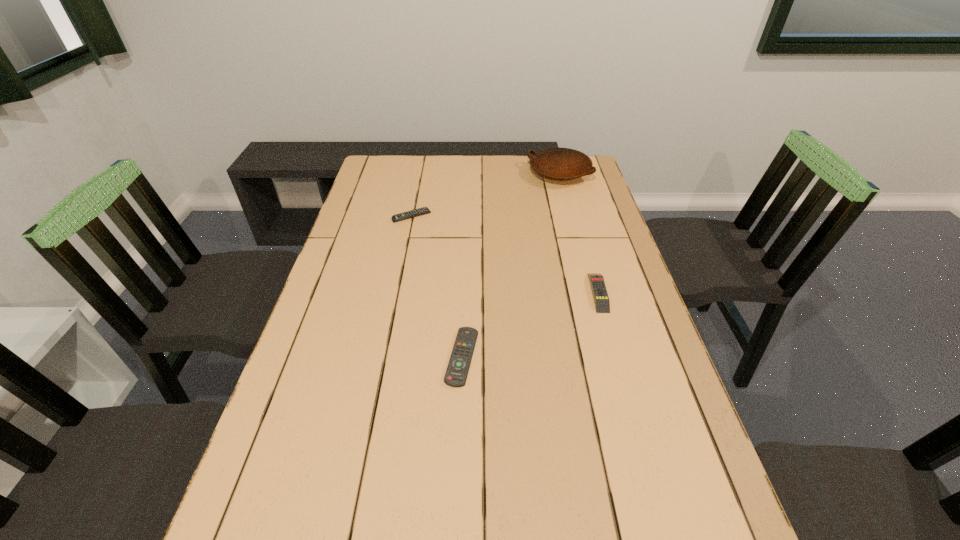
Where is `vacant space situated on the front of the leftmost remote control`? The image size is (960, 540). vacant space situated on the front of the leftmost remote control is located at coordinates (397, 286).

Identify the location of vacant space situated on the left of the second object from left to right. coord(361,357).

This screenshot has width=960, height=540. Identify the location of object positioned at the far edge. (556, 163).

What are the coordinates of `object at the left edge` in the screenshot? It's located at (424, 210).

This screenshot has width=960, height=540. Find the location of `plate located in the right edge section of the desktop`. plate located in the right edge section of the desktop is located at coordinates (556, 163).

Where is `remote control situated at the right edge`? The width and height of the screenshot is (960, 540). remote control situated at the right edge is located at coordinates (602, 304).

Locate an element on the screen. This screenshot has width=960, height=540. object situated at the far right corner is located at coordinates (556, 163).

The image size is (960, 540). Find the location of `vacant space at the far edge`. vacant space at the far edge is located at coordinates (437, 171).

Where is `blank area at the left edge`? This screenshot has width=960, height=540. blank area at the left edge is located at coordinates (276, 511).

In the image, there is a desktop. Where is `vacant space at the right edge`? vacant space at the right edge is located at coordinates (667, 417).